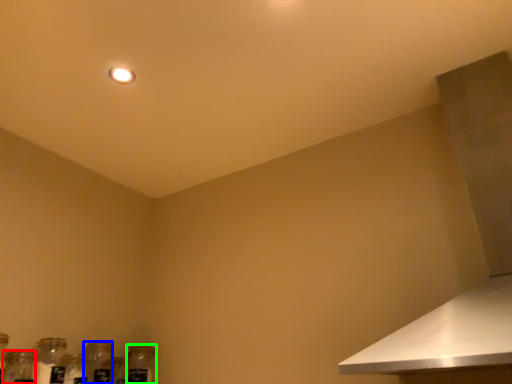
Question: Considering the real-world distances, which object is closest to glass jar (highlighted by a red box)? bottle (highlighted by a blue box) or glass bottle (highlighted by a green box).

Choices:
 (A) bottle
 (B) glass bottle

Answer: (A)